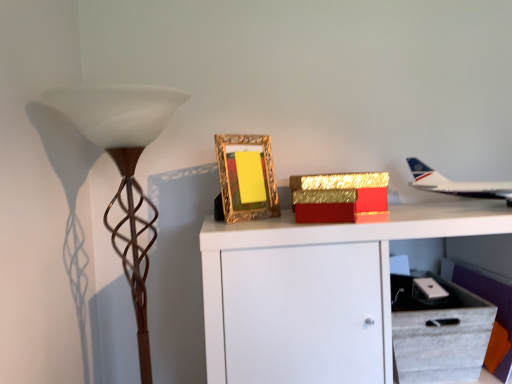
Question: Is white glossy airplane at upper right at the right side of gold ornate frame at center?

Choices:
 (A) yes
 (B) no

Answer: (A)

Question: Is white glossy airplane at upper right at the left side of gold ornate frame at center?

Choices:
 (A) yes
 (B) no

Answer: (B)

Question: From a real-world perspective, is white glossy airplane at upper right located beneath gold ornate frame at center?

Choices:
 (A) no
 (B) yes

Answer: (B)

Question: Does white glossy airplane at upper right come in front of gold ornate frame at center?

Choices:
 (A) yes
 (B) no

Answer: (A)

Question: From the image's perspective, is white glossy airplane at upper right beneath gold ornate frame at center?

Choices:
 (A) yes
 (B) no

Answer: (A)

Question: Is white glossy airplane at upper right in front of or behind brown textured floor lamp at left in the image?

Choices:
 (A) behind
 (B) front

Answer: (A)

Question: From a real-world perspective, is white glossy airplane at upper right positioned above or below brown textured floor lamp at left?

Choices:
 (A) below
 (B) above

Answer: (B)

Question: Considering the positions of white glossy airplane at upper right and brown textured floor lamp at left in the image, is white glossy airplane at upper right bigger or smaller than brown textured floor lamp at left?

Choices:
 (A) big
 (B) small

Answer: (B)

Question: In terms of height, does white glossy airplane at upper right look taller or shorter compared to brown textured floor lamp at left?

Choices:
 (A) tall
 (B) short

Answer: (B)

Question: From their relative heights in the image, would you say white fabric drawer at lower right is taller or shorter than gold glittery box at upper center?

Choices:
 (A) short
 (B) tall

Answer: (B)

Question: Considering their positions, is white fabric drawer at lower right located in front of or behind gold glittery box at upper center?

Choices:
 (A) front
 (B) behind

Answer: (A)

Question: From the image's perspective, is white fabric drawer at lower right positioned above or below gold glittery box at upper center?

Choices:
 (A) below
 (B) above

Answer: (A)

Question: Based on their positions, is white fabric drawer at lower right located to the left or right of gold glittery box at upper center?

Choices:
 (A) left
 (B) right

Answer: (B)

Question: From a real-world perspective, is brown textured floor lamp at left physically located above or below gold ornate frame at center?

Choices:
 (A) above
 (B) below

Answer: (B)

Question: Visually, is brown textured floor lamp at left positioned to the left or to the right of gold ornate frame at center?

Choices:
 (A) left
 (B) right

Answer: (A)